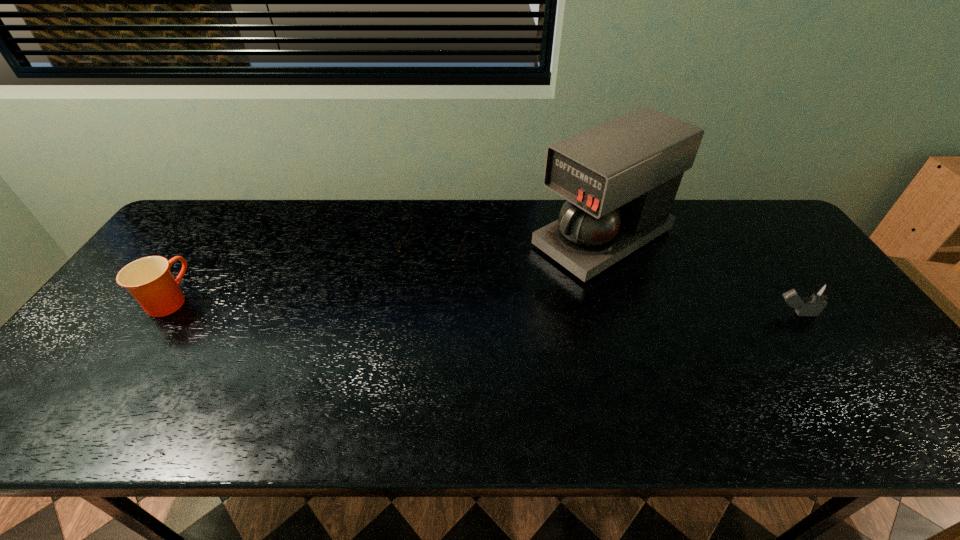
The width and height of the screenshot is (960, 540). Find the location of `cup`. cup is located at coordinates (149, 280).

This screenshot has height=540, width=960. What are the coordinates of `the rightmost object` in the screenshot? It's located at (815, 302).

This screenshot has width=960, height=540. Find the location of `coffee maker`. coffee maker is located at coordinates (620, 178).

I want to click on the second object from right to left, so click(x=620, y=178).

I want to click on the third object from right to left, so click(443, 265).

Locate an element on the screen. The width and height of the screenshot is (960, 540). spectacles is located at coordinates (443, 265).

In order to click on free spot located 0.160m on the back of the cup in this screenshot , I will do `click(207, 245)`.

The width and height of the screenshot is (960, 540). Identify the location of free point located 0.290m on the left of the rightmost object. (661, 314).

At what (x,y) coordinates should I click in order to perform the action: click on vacant space located on the carafe side of the coffee maker. Please return your answer as a coordinate pair (x, y). This screenshot has height=540, width=960. Looking at the image, I should click on (458, 319).

At what (x,y) coordinates should I click in order to perform the action: click on free point located on the carafe side of the coffee maker. Please return your answer as a coordinate pair (x, y). The width and height of the screenshot is (960, 540). Looking at the image, I should click on tap(519, 284).